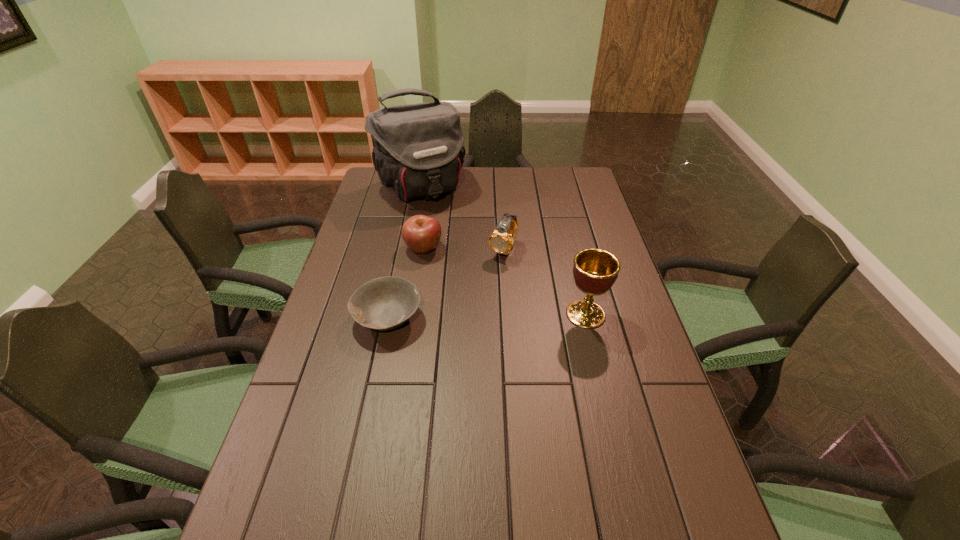
The height and width of the screenshot is (540, 960). Find the location of `bowl`. bowl is located at coordinates (385, 303).

Locate an element on the screen. Image resolution: width=960 pixels, height=540 pixels. the second tallest object is located at coordinates (595, 270).

The height and width of the screenshot is (540, 960). In order to click on the rightmost object in this screenshot , I will do `click(595, 270)`.

Find the location of a particular element. Image resolution: width=960 pixels, height=540 pixels. watch is located at coordinates (501, 241).

Image resolution: width=960 pixels, height=540 pixels. Find the location of `the third tallest object`. the third tallest object is located at coordinates (501, 241).

Identify the location of the tallest object. This screenshot has width=960, height=540. (418, 151).

This screenshot has width=960, height=540. I want to click on the farthest object, so click(418, 151).

Where is `apple`? The height and width of the screenshot is (540, 960). apple is located at coordinates (421, 233).

The height and width of the screenshot is (540, 960). Find the location of `free space located 0.350m on the right of the shortest object`. free space located 0.350m on the right of the shortest object is located at coordinates (544, 318).

What are the coordinates of `free point located 0.160m on the back of the fourth shortest object` in the screenshot? It's located at (574, 265).